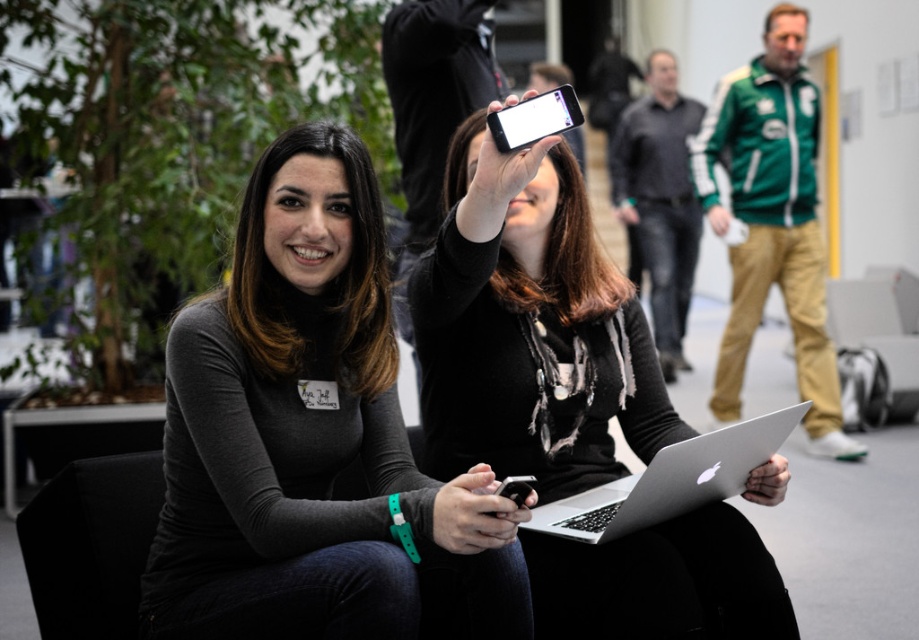
Based on the scene description, where is the silver metallic laptop at center located in relation to the two women?

The silver metallic laptop at center is located at point [668,481].

From the picture: You are trying to decide which object is on the right side between the green fabric jacket at upper right and the light skin flesh at center. Based on the scene description, which one is located to the right?

The green fabric jacket at upper right is positioned on the right side of light skin flesh at center, so the green fabric jacket at upper right is the one located to the right.

Consider the image. You are trying to decide whether to place a rectangular box that is 10 cm wide on a table between the matte black sweater at center and the white glossy phone at upper center. Based on their widths, will the box fit between them?

The matte black sweater at center is wider than the white glossy phone at upper center. Since the sweater is wider, the combined space between them may not accommodate the 10 cm box. However, without knowing the exact distance between them, it is uncertain if the box will fit.